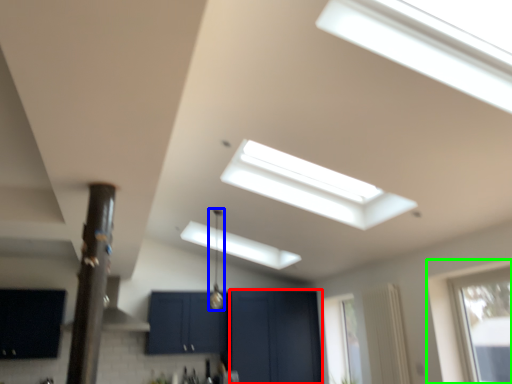
Question: Based on their relative distances, which object is farther from screen door (highlighted by a red box)? Choose from light fixture (highlighted by a blue box) and window (highlighted by a green box).

Choices:
 (A) light fixture
 (B) window

Answer: (B)